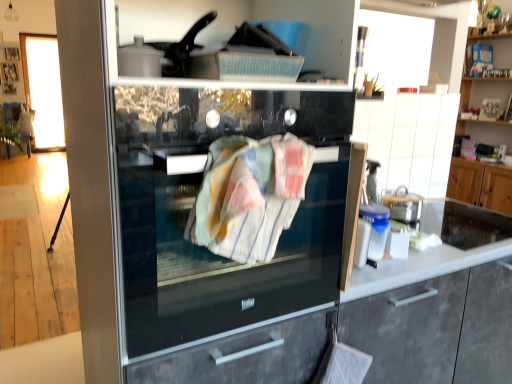
The width and height of the screenshot is (512, 384). Describe the element at coordinates (249, 195) in the screenshot. I see `striped cotton towel at center` at that location.

Image resolution: width=512 pixels, height=384 pixels. What do you see at coordinates (481, 185) in the screenshot?
I see `wooden cabinet at upper right, marked as the first cabinetry in a right-to-left arrangement` at bounding box center [481, 185].

Find the location of `white tile cabinetry at upper right, the 3th cabinetry from the right`. white tile cabinetry at upper right, the 3th cabinetry from the right is located at coordinates (409, 139).

From the image's perspective, which one is positioned lower, striped cotton towel at center or wooden cabinet at upper right, marked as the first cabinetry in a right-to-left arrangement?

striped cotton towel at center is shown below in the image.

Could you tell me if striped cotton towel at center is facing wooden cabinet at upper right, which is counted as the third cabinetry, starting from the left?

No, striped cotton towel at center is not oriented towards wooden cabinet at upper right, which is counted as the third cabinetry, starting from the left.

Based on the photo, does striped cotton towel at center have a greater height compared to wooden cabinet at upper right, placed as the 3th cabinetry when sorted from front to back?

No, striped cotton towel at center is not taller than wooden cabinet at upper right, placed as the 3th cabinetry when sorted from front to back.

Find the location of `blanket located below the wooden cabinet at upper right, which is counted as the third cabinetry, starting from the left (from the image's perspective)`. blanket located below the wooden cabinet at upper right, which is counted as the third cabinetry, starting from the left (from the image's perspective) is located at coordinates (249, 195).

Which of these two, white glossy countertop at right or striped cotton towel at center, stands shorter?

white glossy countertop at right is shorter.

Is the surface of white glossy countertop at right in direct contact with striped cotton towel at center?

No, white glossy countertop at right is not next to striped cotton towel at center.

How different are the orientations of white glossy countertop at right and striped cotton towel at center in degrees?

The angular difference between white glossy countertop at right and striped cotton towel at center is 90 degrees.

This screenshot has width=512, height=384. Identify the location of countertop on the right of the striped cotton towel at center. (439, 248).

Is white glossy countertop at right facing away from black glass fridge at center?

No, white glossy countertop at right's orientation is not away from black glass fridge at center.

Is white glossy countertop at right spatially inside black glass fridge at center, or outside of it?

white glossy countertop at right is spatially situated outside black glass fridge at center.

Is white glossy countertop at right at the left side of black glass fridge at center?

In fact, white glossy countertop at right is to the right of black glass fridge at center.

Does white tile cabinetry at upper right, the 3th cabinetry from the right, lie behind black glass fridge at center?

Yes, white tile cabinetry at upper right, the 3th cabinetry from the right, is behind black glass fridge at center.

In terms of size, does white tile cabinetry at upper right, positioned as the second cabinetry in front-to-back order, appear bigger or smaller than black glass fridge at center?

Considering their sizes, white tile cabinetry at upper right, positioned as the second cabinetry in front-to-back order, takes up less space than black glass fridge at center.

Would you say white tile cabinetry at upper right, marked as the first cabinetry in a left-to-right arrangement, is outside black glass fridge at center?

Yes.

From the image's perspective, does white tile cabinetry at upper right, marked as the first cabinetry in a left-to-right arrangement, appear lower than black glass fridge at center?

No, from the image's perspective, white tile cabinetry at upper right, marked as the first cabinetry in a left-to-right arrangement, is not below black glass fridge at center.

Between point (510, 177) and point (450, 131), which one is positioned in front?

The point (450, 131) is more forward.

Is wooden cabinet at upper right, placed as the 3th cabinetry when sorted from front to back, positioned with its back to white tile cabinetry at upper right, positioned as the second cabinetry in front-to-back order?

No, wooden cabinet at upper right, placed as the 3th cabinetry when sorted from front to back, is not facing away from white tile cabinetry at upper right, positioned as the second cabinetry in front-to-back order.

Measure the distance from wooden cabinet at upper right, placed as the 3th cabinetry when sorted from front to back, to white tile cabinetry at upper right, the 3th cabinetry from the right.

wooden cabinet at upper right, placed as the 3th cabinetry when sorted from front to back, is 1.83 meters from white tile cabinetry at upper right, the 3th cabinetry from the right.

From a real-world perspective, is wooden cabinet at upper right, placed as the 3th cabinetry when sorted from front to back, positioned over white tile cabinetry at upper right, the second cabinetry from the back, based on gravity?

Yes, from a real-world perspective, wooden cabinet at upper right, placed as the 3th cabinetry when sorted from front to back, is on top of white tile cabinetry at upper right, the second cabinetry from the back.

Based on the photo, how many degrees apart are the facing directions of white tile cabinetry at upper right, the second cabinetry from the back, and striped cotton towel at center?

There is a 90.1-degree angle between the facing directions of white tile cabinetry at upper right, the second cabinetry from the back, and striped cotton towel at center.

Based on the photo, is white tile cabinetry at upper right, the 3th cabinetry from the right, positioned with its back to striped cotton towel at center?

No, white tile cabinetry at upper right, the 3th cabinetry from the right, is not facing the opposite direction of striped cotton towel at center.

Based on the photo, how far apart are white tile cabinetry at upper right, the second cabinetry from the back, and striped cotton towel at center?

white tile cabinetry at upper right, the second cabinetry from the back, is 1.15 meters away from striped cotton towel at center.

Is white tile cabinetry at upper right, marked as the first cabinetry in a left-to-right arrangement, not near striped cotton towel at center?

Yes, white tile cabinetry at upper right, marked as the first cabinetry in a left-to-right arrangement, and striped cotton towel at center are located far from each other.

Considering the relative sizes of white tile cabinetry at upper right, the second cabinetry from the back, and wooden cabinet at upper right, acting as the 1th cabinetry starting from the back, in the image provided, is white tile cabinetry at upper right, the second cabinetry from the back, smaller than wooden cabinet at upper right, acting as the 1th cabinetry starting from the back,?

Yes.

From a real-world perspective, is white tile cabinetry at upper right, marked as the first cabinetry in a left-to-right arrangement, physically below wooden cabinet at upper right, acting as the 1th cabinetry starting from the back?

Correct, in the physical world, white tile cabinetry at upper right, marked as the first cabinetry in a left-to-right arrangement, is lower than wooden cabinet at upper right, acting as the 1th cabinetry starting from the back.

Is white tile cabinetry at upper right, the second cabinetry from the back, thinner than wooden cabinet at upper right, acting as the 1th cabinetry starting from the back?

Yes, white tile cabinetry at upper right, the second cabinetry from the back, is thinner than wooden cabinet at upper right, acting as the 1th cabinetry starting from the back.

Is white tile cabinetry at upper right, marked as the first cabinetry in a left-to-right arrangement, to the right of wooden cabinet at upper right, which is counted as the third cabinetry, starting from the left, from the viewer's perspective?

No.

This screenshot has width=512, height=384. There is a striped cotton towel at center. Identify the location of the 2nd cabinetry above it (from the image's perspective). (481, 185).

Find the location of a particular element. The image size is (512, 384). countertop behind the striped cotton towel at center is located at coordinates (439, 248).

From the image, which object appears to be nearer to white tile cabinetry at upper right, the second cabinetry from the back, wooden cabinet at upper right, which is counted as the third cabinetry, starting from the left, or white glossy countertop at right?

white glossy countertop at right is closer to white tile cabinetry at upper right, the second cabinetry from the back.

Based on their spatial positions, is striped cotton towel at center or white glossy countertop at right further from wooden cabinet at upper right, acting as the 1th cabinetry starting from the back?

striped cotton towel at center.

Based on their spatial positions, is white glossy countertop at right or striped cotton towel at center further from matte gray cabinet at center, which ranks as the 3th cabinetry in back-to-front order?

Based on the image, striped cotton towel at center appears to be further to matte gray cabinet at center, which ranks as the 3th cabinetry in back-to-front order.

Based on the photo, estimate the real-world distances between objects in this image. Which object is further from black glass fridge at center, white tile cabinetry at upper right, marked as the first cabinetry in a left-to-right arrangement, or white glossy countertop at right?

The object further to black glass fridge at center is white tile cabinetry at upper right, marked as the first cabinetry in a left-to-right arrangement.

From the image, which object appears to be nearer to white glossy countertop at right, wooden cabinet at upper right, marked as the first cabinetry in a right-to-left arrangement, or striped cotton towel at center?

striped cotton towel at center is closer to white glossy countertop at right.

Looking at the image, which one is located closer to matte gray cabinet at center, the second cabinetry from the left, white glossy countertop at right or black glass fridge at center?

Among the two, white glossy countertop at right is located nearer to matte gray cabinet at center, the second cabinetry from the left.

Looking at the image, which one is located closer to black glass fridge at center, wooden cabinet at upper right, placed as the 3th cabinetry when sorted from front to back, or striped cotton towel at center?

Among the two, striped cotton towel at center is located nearer to black glass fridge at center.

When comparing their distances from matte gray cabinet at center, the second cabinetry from the left, does striped cotton towel at center or white tile cabinetry at upper right, marked as the first cabinetry in a left-to-right arrangement, seem further?

Based on the image, white tile cabinetry at upper right, marked as the first cabinetry in a left-to-right arrangement, appears to be further to matte gray cabinet at center, the second cabinetry from the left.

I want to click on countertop between striped cotton towel at center and white tile cabinetry at upper right, marked as the first cabinetry in a left-to-right arrangement, along the z-axis, so click(x=439, y=248).

Where is `countertop between black glass fridge at center and white tile cabinetry at upper right, the 3th cabinetry from the right, in the front-back direction`? Image resolution: width=512 pixels, height=384 pixels. countertop between black glass fridge at center and white tile cabinetry at upper right, the 3th cabinetry from the right, in the front-back direction is located at coordinates [x=439, y=248].

This screenshot has height=384, width=512. I want to click on countertop between white tile cabinetry at upper right, marked as the first cabinetry in a left-to-right arrangement, and matte gray cabinet at center, which ranks as the 3th cabinetry in back-to-front order, vertically, so click(x=439, y=248).

This screenshot has width=512, height=384. In order to click on countertop located between striped cotton towel at center and wooden cabinet at upper right, acting as the 1th cabinetry starting from the back, in the depth direction in this screenshot , I will do `click(439, 248)`.